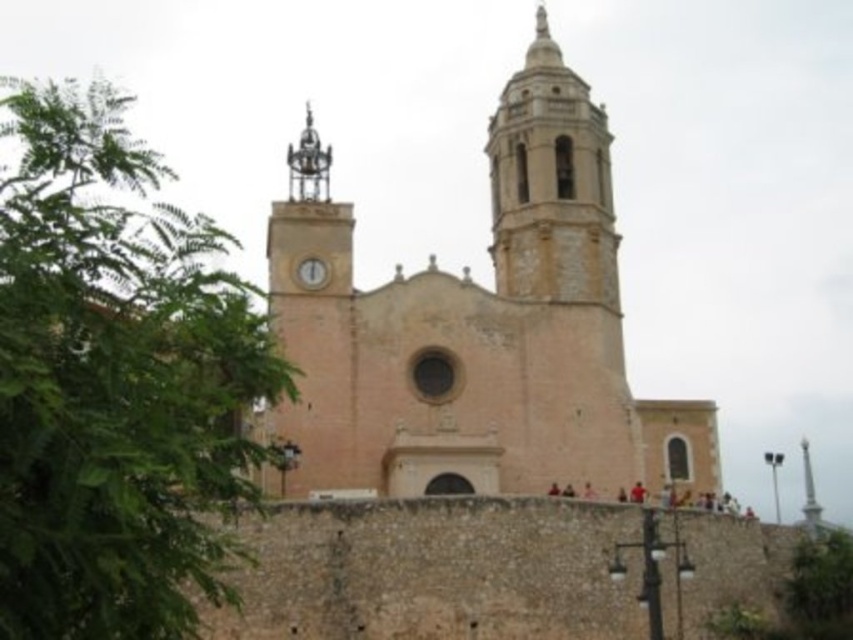
You are a gardener planning to plant a new tree in front of the church. The existing green leafy tree at left is currently occupying space. If you want to ensure the new tree won not block the view of the white glossy clock at center, which object should you consider the width of when deciding where to plant?

You should consider the width of the green leafy tree at left because it might be wider than the white glossy clock at center, so planting the new tree near it could block the view.

You are standing at point (114, 380) in front of the historic church. What can you see at this location?

At point (114, 380), there is a green leafy tree at left.